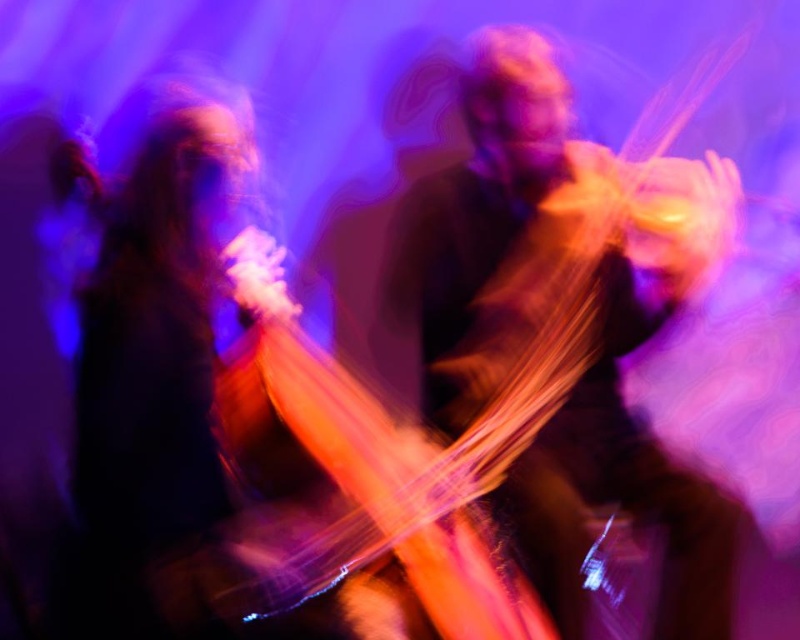
Who is more distant from viewer, [596,353] or [338,381]?

Point [596,353]

Is wooden violin at center wider than translucent orange cello at center?

Indeed, wooden violin at center has a greater width compared to translucent orange cello at center.

Identify the location of wooden violin at center. The width and height of the screenshot is (800, 640). (548, 317).

Who is lower down, wooden violin at center or shiny black guitar at left?

wooden violin at center is lower down.

Is the position of wooden violin at center more distant than that of shiny black guitar at left?

That is True.

Locate an element on the screen. The width and height of the screenshot is (800, 640). wooden violin at center is located at coordinates (548, 317).

Which is below, shiny black guitar at left or translucent orange cello at center?

translucent orange cello at center

Does point (128, 566) come closer to viewer compared to point (396, 477)?

Yes, point (128, 566) is in front of point (396, 477).

Is point (96, 188) behind point (302, 362)?

Yes.

Where is `shiny black guitar at left`? The height and width of the screenshot is (640, 800). shiny black guitar at left is located at coordinates (152, 339).